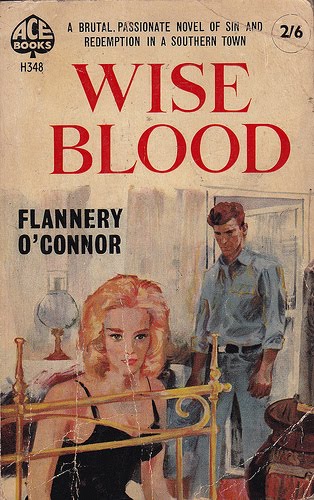
The width and height of the screenshot is (314, 500). In order to click on wall in this screenshot , I will do (x=35, y=280).